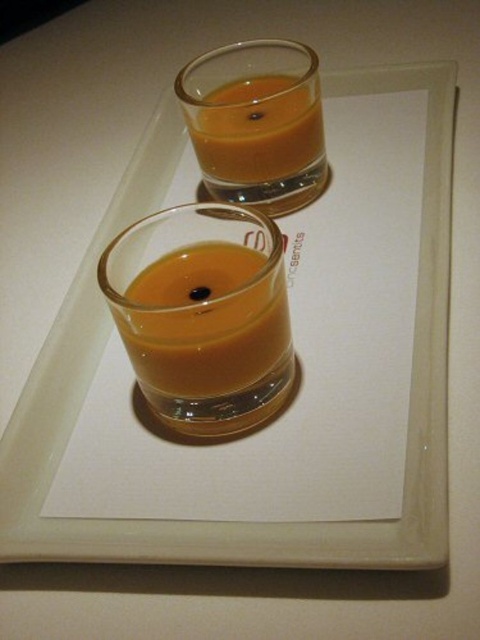
Can you confirm if matte orange liquid at center is positioned above matte glass at upper center?

Actually, matte orange liquid at center is below matte glass at upper center.

Does point (187, 323) come behind point (254, 97)?

That is False.

Find the location of a particular element. Image resolution: width=480 pixels, height=640 pixels. matte orange liquid at center is located at coordinates (208, 336).